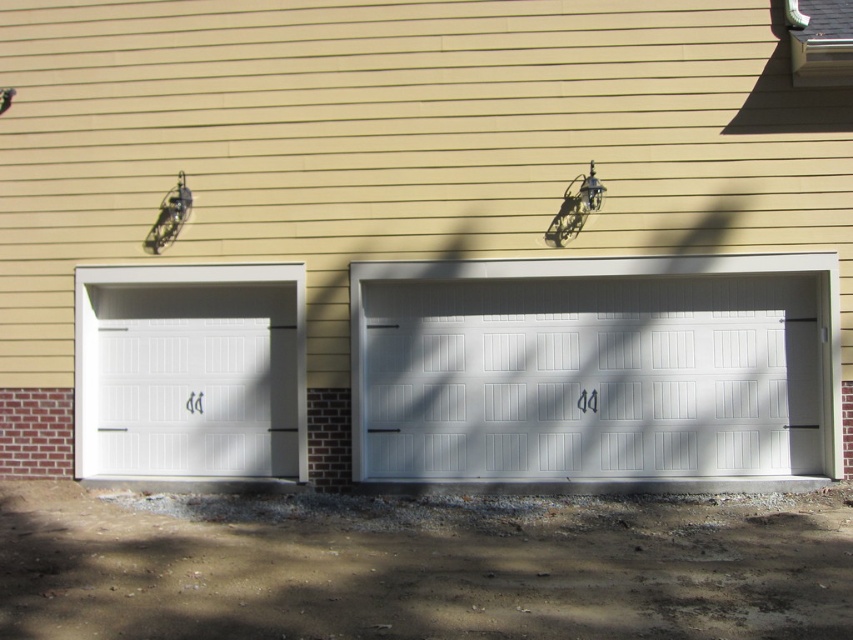
Which of these two, dirt at lower center or white painted wood garage door at center, stands shorter?

With less height is dirt at lower center.

Image resolution: width=853 pixels, height=640 pixels. I want to click on dirt at lower center, so click(421, 566).

Who is more distant from viewer, (224, 636) or (490, 308)?

Positioned behind is point (490, 308).

At what (x,y) coordinates should I click in order to perform the action: click on dirt at lower center. Please return your answer as a coordinate pair (x, y). This screenshot has width=853, height=640. Looking at the image, I should click on (421, 566).

Is point (334, 568) in front of point (289, 273)?

Yes, point (334, 568) is closer to viewer.

Is dirt at lower center above white painted wood garage door at left?

Incorrect, dirt at lower center is not positioned above white painted wood garage door at left.

Is point (102, 493) less distant than point (132, 321)?

Yes, point (102, 493) is in front of point (132, 321).

At what (x,y) coordinates should I click in order to perform the action: click on dirt at lower center. Please return your answer as a coordinate pair (x, y). Looking at the image, I should click on (421, 566).

Who is higher up, white painted wood garage door at center or white painted wood garage door at left?

white painted wood garage door at left

Does white painted wood garage door at center appear under white painted wood garage door at left?

Indeed, white painted wood garage door at center is positioned under white painted wood garage door at left.

Is point (498, 413) farther from viewer compared to point (103, 268)?

No, (498, 413) is in front of (103, 268).

Locate an element on the screen. white painted wood garage door at center is located at coordinates (596, 369).